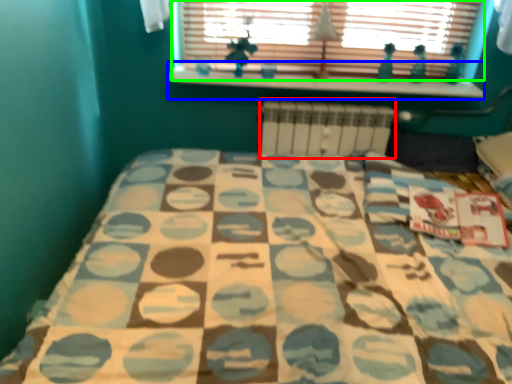
Question: Estimate the real-world distances between objects in this image. Which object is closer to radiator (highlighted by a red box), window sill (highlighted by a blue box) or window (highlighted by a green box)?

Choices:
 (A) window sill
 (B) window

Answer: (A)